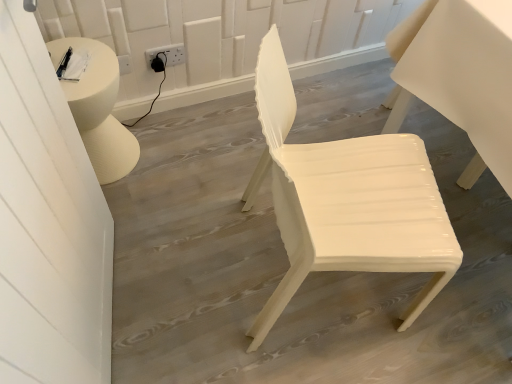
In order to click on free space underneath glossy white chair at center (from a real-world perspective) in this screenshot , I will do click(x=312, y=284).